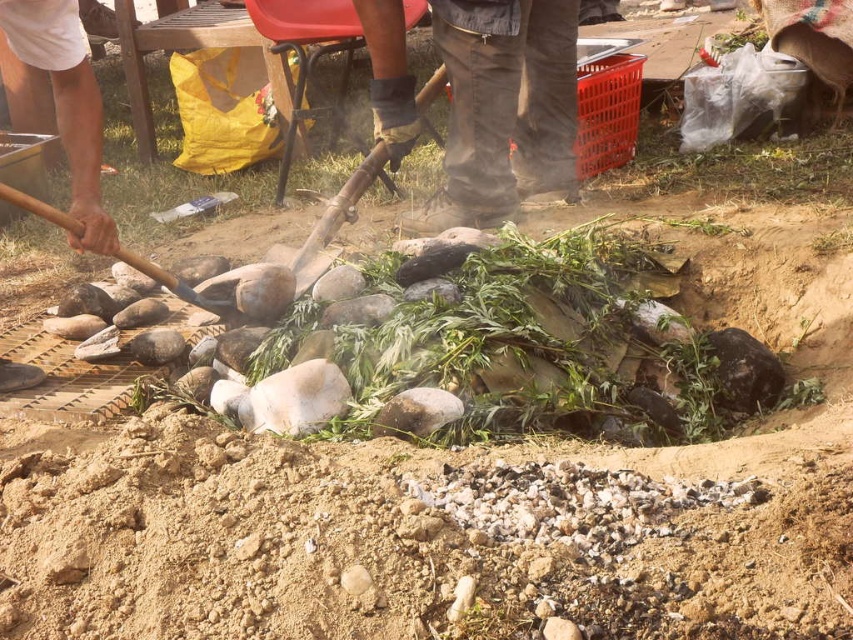
You are standing at the origin point of the coordinate system. You want to move towards the wooden shovel at center. What are the coordinates you need to move to reach it?

The wooden shovel at center is located at coordinates point (x=334, y=220). So you need to move to point (x=334, y=220) to reach it.

You are a construction worker needing to choose a tool to move a pile of rocks. You have two options at the center of the image. Which one is wider, the wooden shovel at center or the wooden handle shovel at center?

The wooden shovel at center is wider than the wooden handle shovel at center.